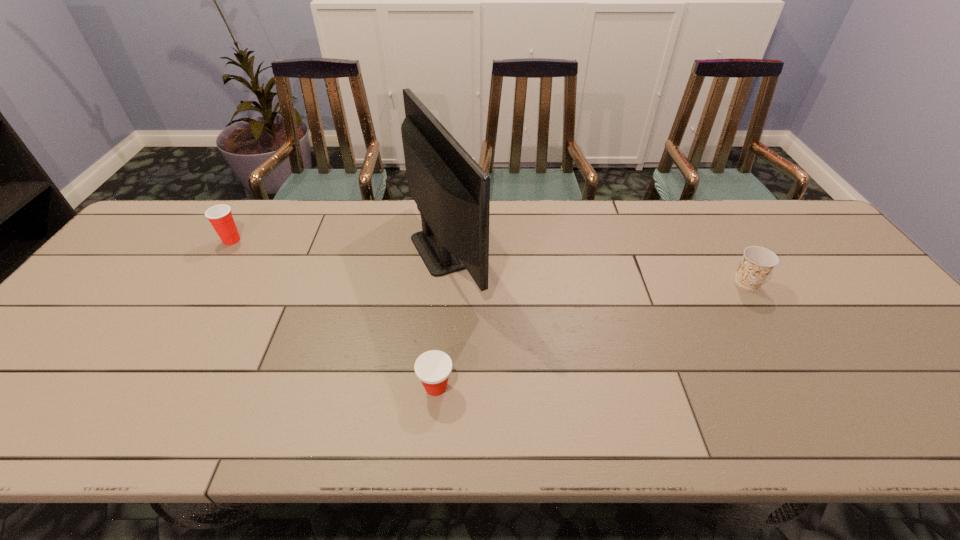
The width and height of the screenshot is (960, 540). In order to click on free spot between the second nearest Dixie cup and the second Dixie cup from right to left in this screenshot , I will do `click(591, 335)`.

Find the location of `free space between the computer monitor and the leftmost Dixie cup`. free space between the computer monitor and the leftmost Dixie cup is located at coordinates 340,245.

Find the location of `empty space that is in between the computer monitor and the rightmost Dixie cup`. empty space that is in between the computer monitor and the rightmost Dixie cup is located at coordinates (596, 266).

This screenshot has height=540, width=960. What are the coordinates of `free space between the leftmost Dixie cup and the nearest Dixie cup` in the screenshot? It's located at (334, 314).

At what (x,y) coordinates should I click in order to perform the action: click on free space between the leftmost object and the shortest Dixie cup. Please return your answer as a coordinate pair (x, y). Looking at the image, I should click on (334, 314).

Locate an element on the screen. free space between the leftmost Dixie cup and the nearest Dixie cup is located at coordinates (334, 314).

Locate an element on the screen. Image resolution: width=960 pixels, height=540 pixels. the closest object to the nearest Dixie cup is located at coordinates (452, 192).

Locate an element on the screen. The height and width of the screenshot is (540, 960). object that is the second closest one to the tallest object is located at coordinates (220, 216).

I want to click on Dixie cup that is the second closest to the computer monitor, so click(x=220, y=216).

You are a GUI agent. You are given a task and a screenshot of the screen. Output one action in this format:
    pyautogui.click(x=<x>, y=<y>)
    Task: Click on the Dixie cup that is the second closest one to the rightmost Dixie cup
    The image size is (960, 540).
    Given the screenshot: What is the action you would take?
    pyautogui.click(x=220, y=216)